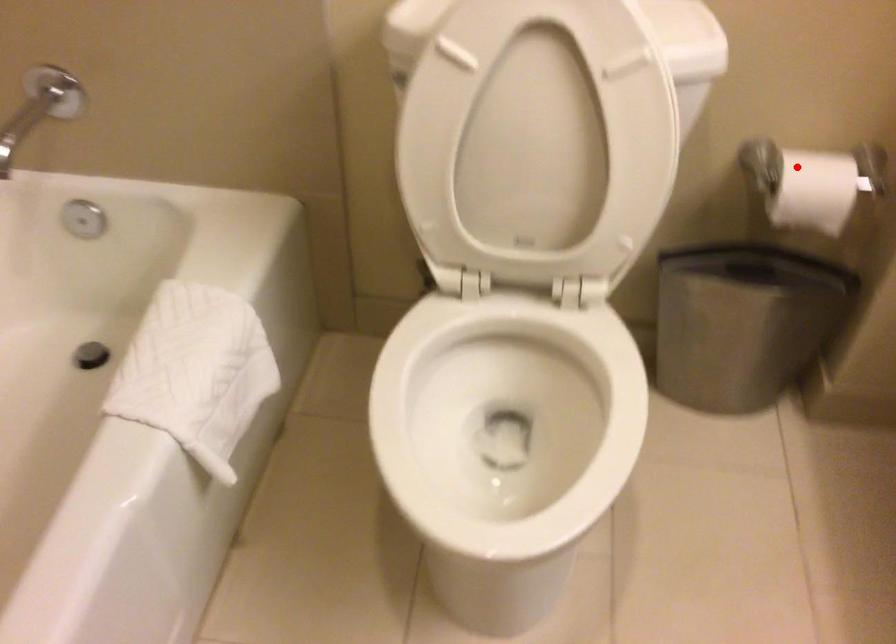
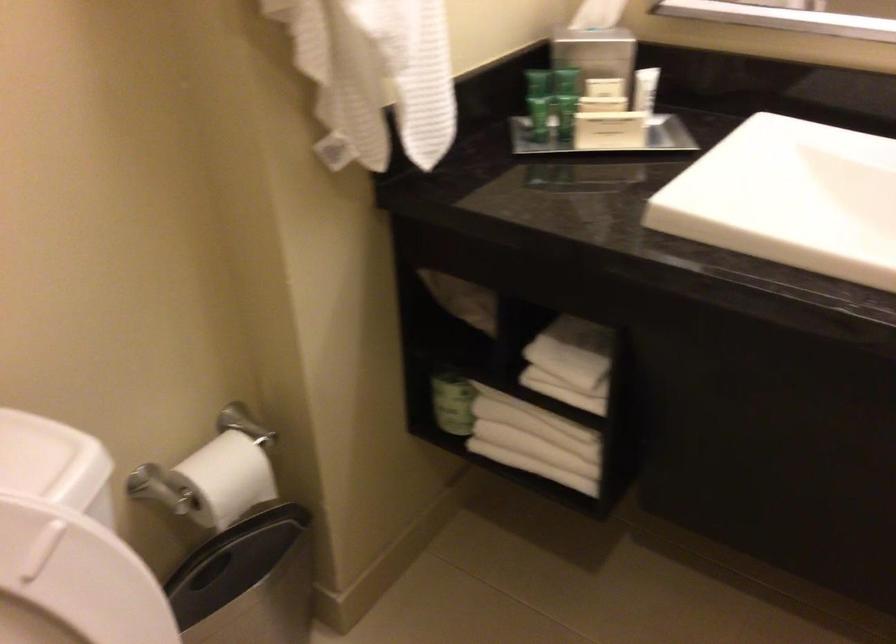
Locate, in the second image, the point that corresponds to the highlighted location in the first image.

(211, 480)